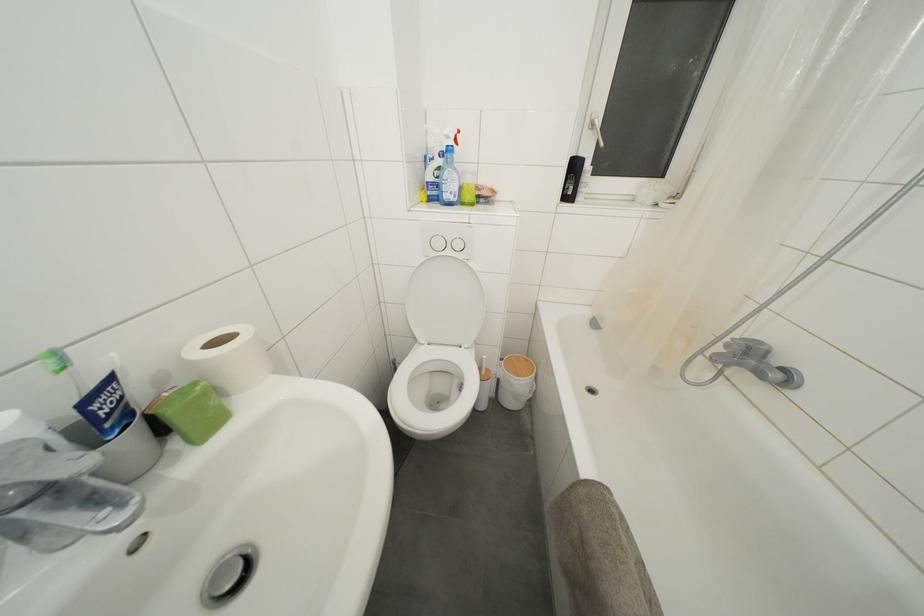
What do you see at coordinates (597, 130) in the screenshot? The image size is (924, 616). I see `a white window handle` at bounding box center [597, 130].